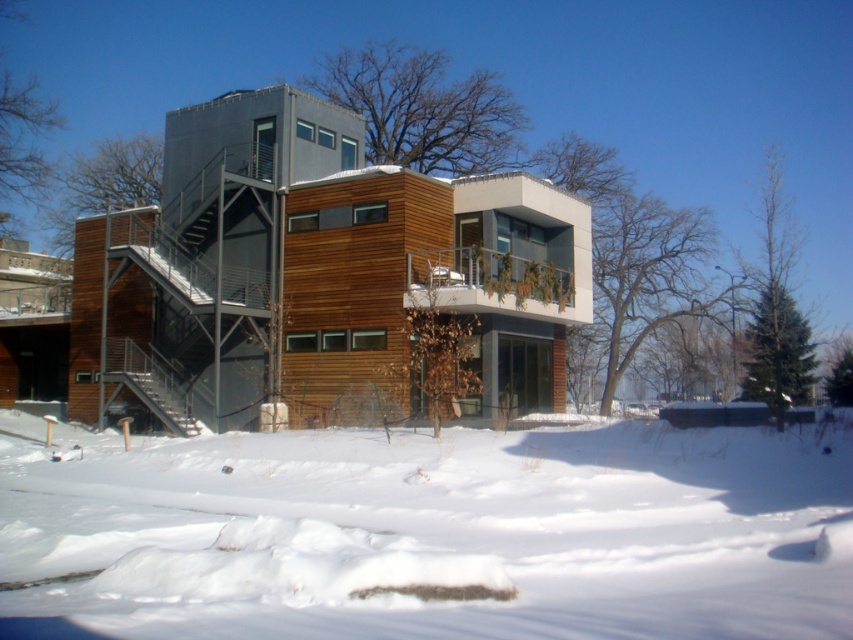
You are standing at the entrance of the house and want to step onto the white fluffy snow at lower center. Is the metallic gray staircase at left between you and the snow?

The white fluffy snow at lower center is closer to the viewer than the metallic gray staircase at left, so the staircase is not between you and the snow. You can step onto the snow without needing to go around the staircase.

You are standing on the balcony of the second level of the house and want to walk down to the white fluffy snow at lower center. However, you need to avoid the metallic gray staircase at left because it might be slippery. Is there another path to reach the snow without using the staircase?

The white fluffy snow at lower center is located below the metallic gray staircase at left, so the staircase is the only direct path to the snow. Since you need to avoid it, there is no other visible path mentioned in the scene description to reach the snow without using the staircase.